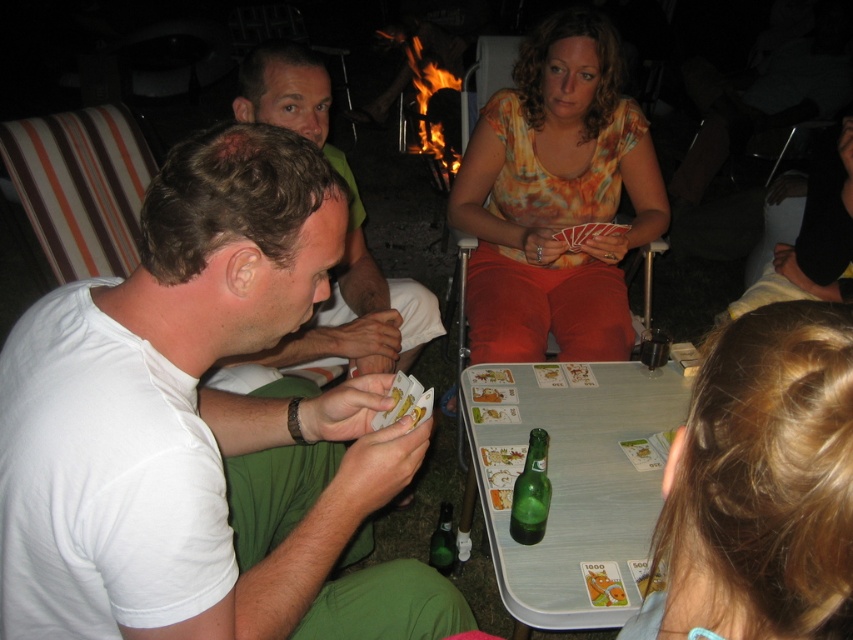
Question: Is green plastic table at center smaller than green glass bottle at center?

Choices:
 (A) yes
 (B) no

Answer: (B)

Question: Is green plastic table at center bigger than green glass bottle at lower center?

Choices:
 (A) no
 (B) yes

Answer: (B)

Question: Which point appears farthest from the camera in this image?

Choices:
 (A) (621, 556)
 (B) (538, 513)
 (C) (289, 449)

Answer: (C)

Question: Which object is the farthest from the green glass bottle at lower center?

Choices:
 (A) orange tie-dye shirt at center
 (B) green glass bottle at center
 (C) white cotton shirt at left

Answer: (C)

Question: Is orange tie-dye shirt at center above green plastic table at center?

Choices:
 (A) no
 (B) yes

Answer: (B)

Question: Among these objects, which one is farthest from the camera?

Choices:
 (A) green glass bottle at center
 (B) green glass bottle at lower center
 (C) green plastic table at center
 (D) orange tie-dye shirt at center

Answer: (D)